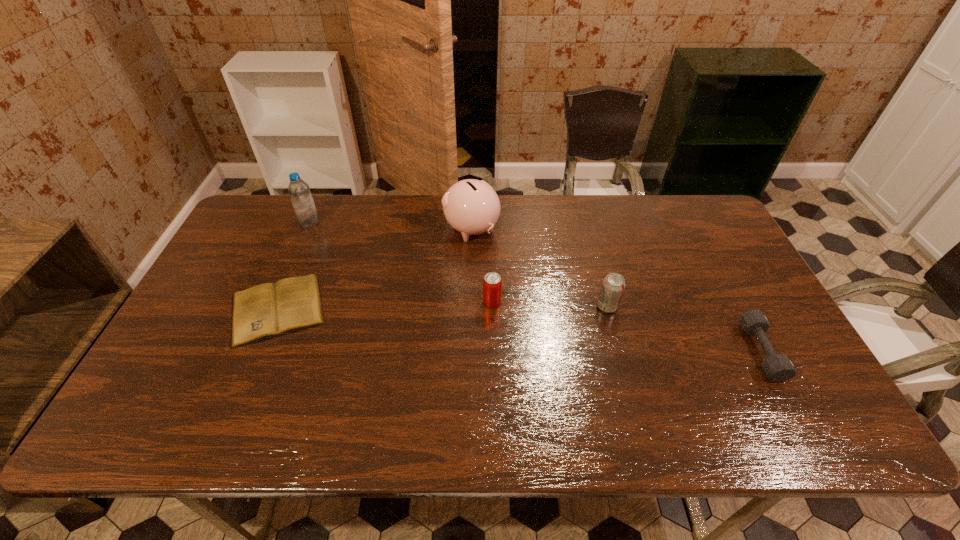
Where is `object that is the fourth closest to the dumbbell`? object that is the fourth closest to the dumbbell is located at coordinates (267, 310).

Identify the location of object that stands as the second closest to the dumbbell. The height and width of the screenshot is (540, 960). (492, 283).

Image resolution: width=960 pixels, height=540 pixels. Find the location of `blank area in the image that satisfies the following two spatial constraints: 1. on the front side of the book; 2. on the right side of the second shortest object`. blank area in the image that satisfies the following two spatial constraints: 1. on the front side of the book; 2. on the right side of the second shortest object is located at coordinates (260, 351).

Where is `vacant space that satisfies the following two spatial constraints: 1. on the back side of the piggy bank; 2. on the right side of the shortest object`? The width and height of the screenshot is (960, 540). vacant space that satisfies the following two spatial constraints: 1. on the back side of the piggy bank; 2. on the right side of the shortest object is located at coordinates (310, 230).